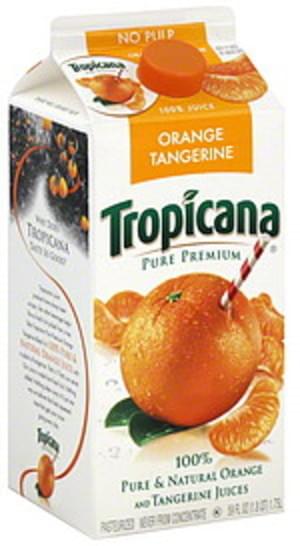
At what (x,y) coordinates should I click in order to perform the action: click on photo of an orange juice carton. Please return your answer as a coordinate pair (x, y). Image resolution: width=300 pixels, height=546 pixels. Looking at the image, I should click on (184, 259).